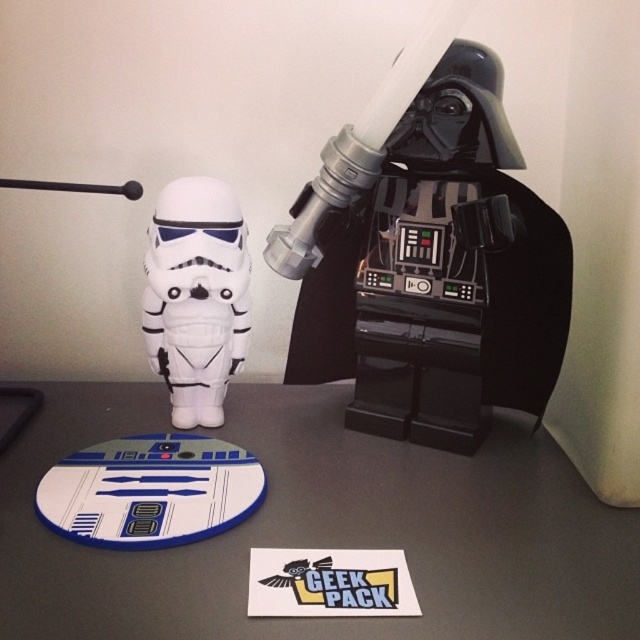
Who is more forward, (504, 467) or (436, 196)?

Point (436, 196)

I want to click on white matte mouse pad at center, so click(x=324, y=529).

Where is `white matte mouse pad at center`? The height and width of the screenshot is (640, 640). white matte mouse pad at center is located at coordinates (324, 529).

Image resolution: width=640 pixels, height=640 pixels. I want to click on white matte mouse pad at center, so click(x=324, y=529).

Does point (472, 420) come in front of point (173, 344)?

That is True.

Which is more to the left, black plastic darth vader at upper right or white matte stormtrooper at center?

From the viewer's perspective, white matte stormtrooper at center appears more on the left side.

What do you see at coordinates (440, 273) in the screenshot? I see `black plastic darth vader at upper right` at bounding box center [440, 273].

The width and height of the screenshot is (640, 640). I want to click on black plastic darth vader at upper right, so click(x=440, y=273).

Can you confirm if white matte mouse pad at center is positioned to the right of white matte stormtrooper at center?

Indeed, white matte mouse pad at center is positioned on the right side of white matte stormtrooper at center.

Which is more to the left, white matte mouse pad at center or white matte stormtrooper at center?

Positioned to the left is white matte stormtrooper at center.

I want to click on white matte mouse pad at center, so click(x=324, y=529).